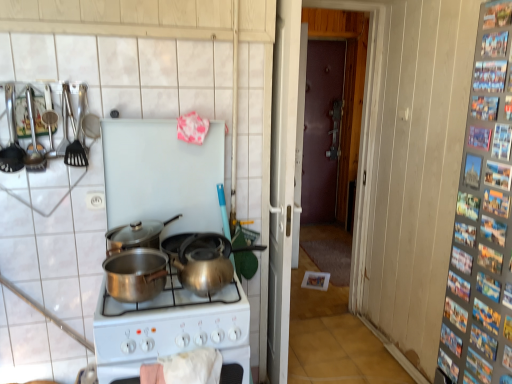
Question: From the image's perspective, is shiny silver wok at center beneath metallic utensils at upper left, which appears as the third kitchen appliance when viewed from the right?

Choices:
 (A) yes
 (B) no

Answer: (A)

Question: Can you confirm if shiny silver wok at center is bigger than metallic utensils at upper left, the 2th kitchen appliance positioned from the left?

Choices:
 (A) no
 (B) yes

Answer: (B)

Question: Is shiny silver wok at center closer to camera compared to metallic utensils at upper left, the 2th kitchen appliance positioned from the left?

Choices:
 (A) yes
 (B) no

Answer: (B)

Question: Can we say shiny silver wok at center lies outside metallic utensils at upper left, which appears as the third kitchen appliance when viewed from the right?

Choices:
 (A) yes
 (B) no

Answer: (A)

Question: Is shiny silver wok at center in contact with metallic utensils at upper left, which appears as the third kitchen appliance when viewed from the right?

Choices:
 (A) yes
 (B) no

Answer: (B)

Question: Is shiny silver wok at center at the right side of metallic utensils at upper left, which appears as the third kitchen appliance when viewed from the right?

Choices:
 (A) yes
 (B) no

Answer: (A)

Question: Could you tell me if shiny silver pot at center, acting as the second kitchen appliance starting from the right, is facing metallic spatula at left, the fourth kitchen appliance from the right?

Choices:
 (A) no
 (B) yes

Answer: (A)

Question: Is shiny silver pot at center, acting as the second kitchen appliance starting from the right, turned away from metallic spatula at left, the fourth kitchen appliance from the right?

Choices:
 (A) no
 (B) yes

Answer: (A)

Question: Does shiny silver pot at center, acting as the second kitchen appliance starting from the right, come behind metallic spatula at left, the fourth kitchen appliance from the right?

Choices:
 (A) no
 (B) yes

Answer: (B)

Question: From a real-world perspective, is shiny silver pot at center, which is the third kitchen appliance from left to right, under metallic spatula at left, which is the first kitchen appliance in left-to-right order?

Choices:
 (A) yes
 (B) no

Answer: (A)

Question: Considering the relative sizes of shiny silver pot at center, acting as the second kitchen appliance starting from the right, and metallic spatula at left, the fourth kitchen appliance from the right, in the image provided, is shiny silver pot at center, acting as the second kitchen appliance starting from the right, taller than metallic spatula at left, the fourth kitchen appliance from the right,?

Choices:
 (A) yes
 (B) no

Answer: (B)

Question: Considering the relative sizes of shiny silver pot at center, acting as the second kitchen appliance starting from the right, and metallic spatula at left, the fourth kitchen appliance from the right, in the image provided, is shiny silver pot at center, acting as the second kitchen appliance starting from the right, wider than metallic spatula at left, the fourth kitchen appliance from the right,?

Choices:
 (A) no
 (B) yes

Answer: (B)

Question: Is shiny silver wok at center located outside shiny silver pot at center, which is the third kitchen appliance from left to right?

Choices:
 (A) no
 (B) yes

Answer: (B)